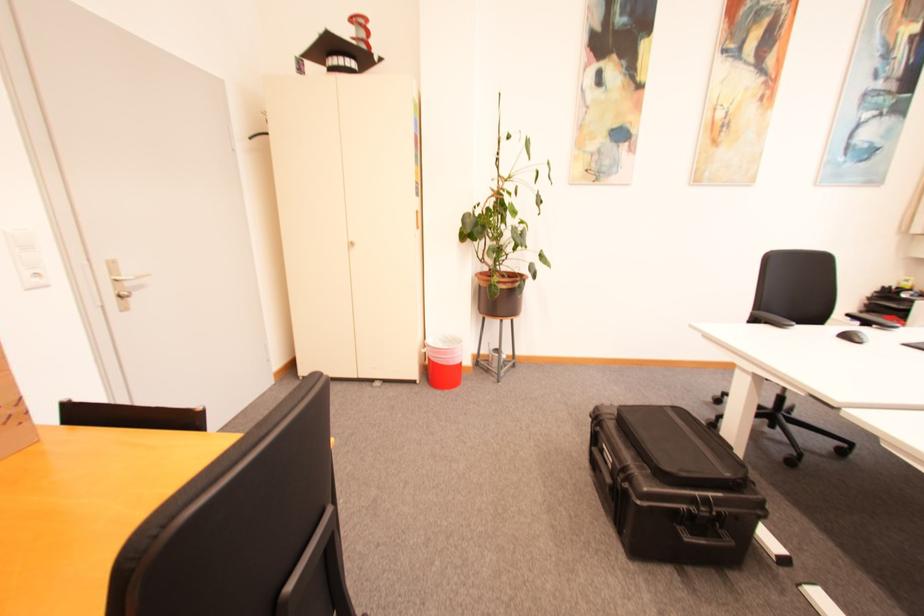
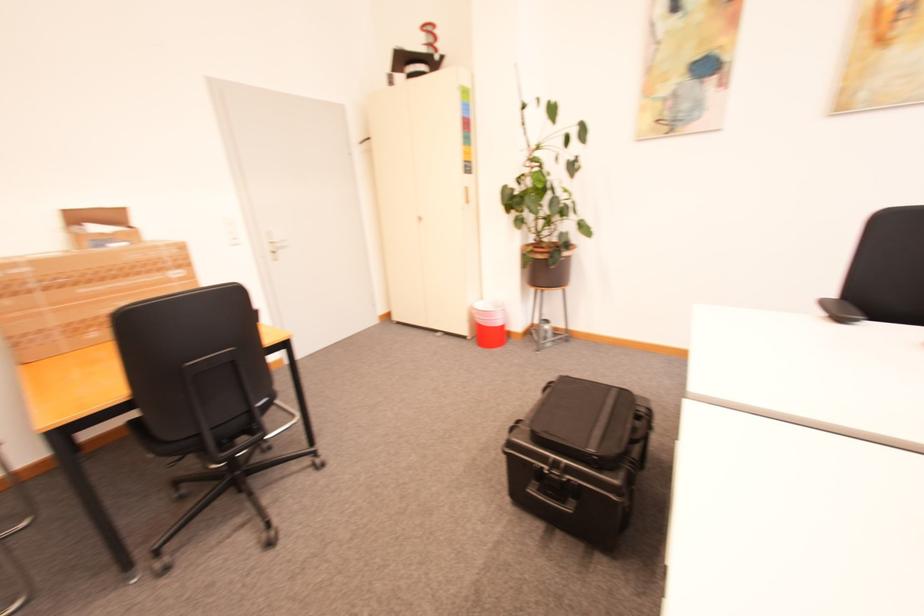
Find the pixel in the second image that matches (x=424, y=228) in the first image.

(473, 203)